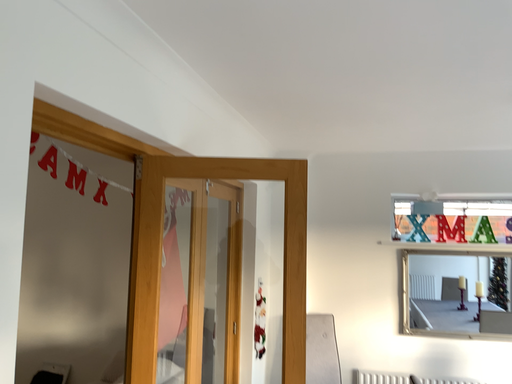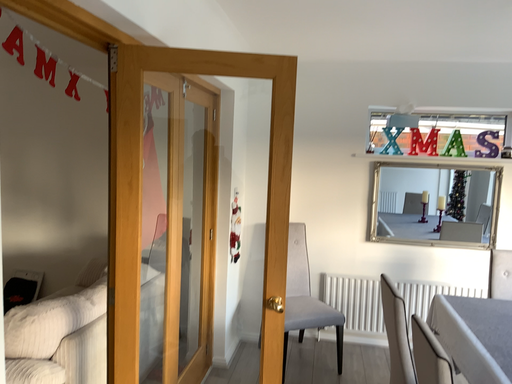
Question: Which way did the camera rotate in the video?

Choices:
 (A) rotated upward
 (B) rotated downward

Answer: (B)